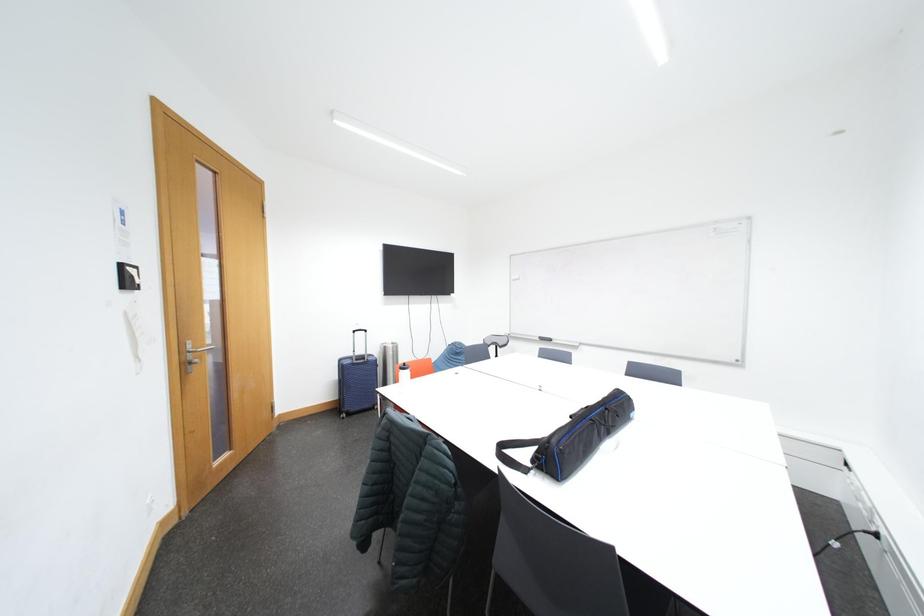
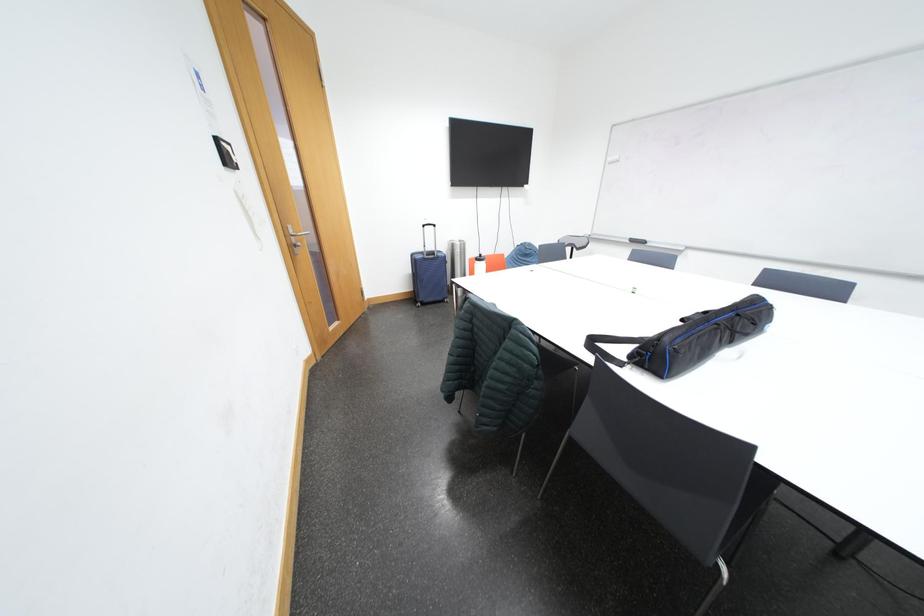
What movement of the cameraman would produce the second image?

The cameraman walked toward left, forward.